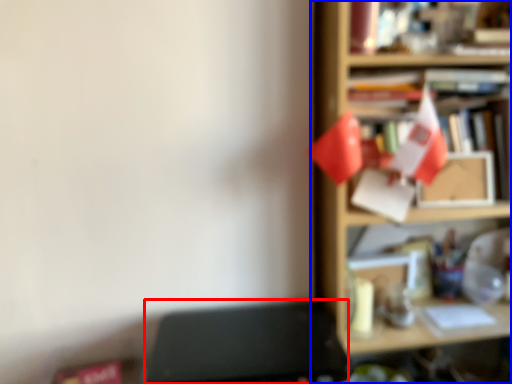
Question: Which of the following is the closest to the observer, writing desk (highlighted by a red box) or shelf (highlighted by a blue box)?

Choices:
 (A) writing desk
 (B) shelf

Answer: (A)